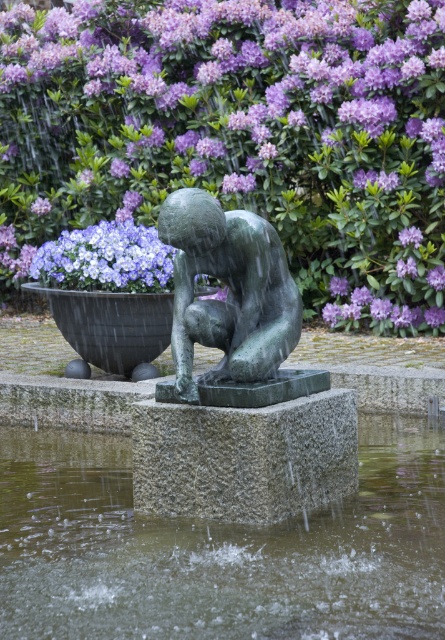
You are standing in the garden and want to take a photo of both the purple matte flowers at upper center and the matte green statue at center. Which object will appear larger in your camera viewfinder?

The purple matte flowers at upper center will appear larger in the camera viewfinder because they are closer to the viewer than the matte green statue at center.

You are a landscape architect designing a new garden and want to place a small bench between the purple matte flower at upper center and the bronze statue of a human figure. The bench requires a minimum of 15 meters of space between the two landmarks to fit. Will there be enough space for the bench?

The distance between the purple matte flower at upper center and the bronze statue of a human figure is 15.16 meters, which is just enough to accommodate the bench requiring 15 meters of space.

You are a gardener who needs to water the purple matte flowers in the garden. You have a watering can with a 3 meter reach. Can you water both the purple matte flower at upper center and the purple matte flower at upper left without moving the watering can?

The distance between the purple matte flower at upper center and the purple matte flower at upper left is 5.62 meters. Since the watering can only reaches 3 meters, you cannot water both flowers without moving the watering can.